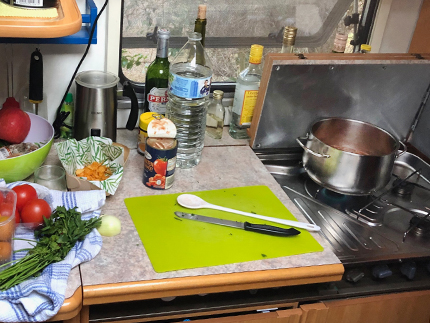
Where is `knob`? knob is located at coordinates point(383,272).